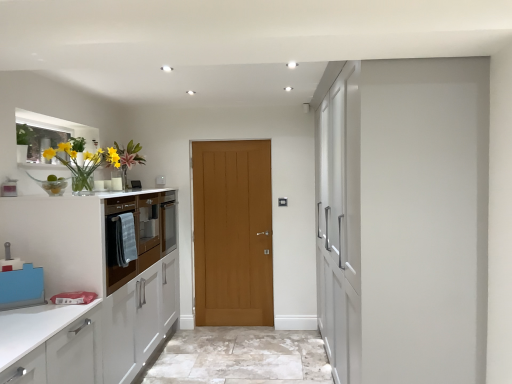
Question: From a real-world perspective, is wooden door at center located higher than matte wood cabinet at left, which is the 1th cabinetry in back-to-front order?

Choices:
 (A) no
 (B) yes

Answer: (A)

Question: Can you confirm if wooden door at center is bigger than matte wood cabinet at left, the second cabinetry in the front-to-back sequence?

Choices:
 (A) yes
 (B) no

Answer: (A)

Question: Is wooden door at center positioned before matte wood cabinet at left, the second cabinetry in the front-to-back sequence?

Choices:
 (A) no
 (B) yes

Answer: (A)

Question: Are wooden door at center and matte wood cabinet at left, which is the 1th cabinetry in back-to-front order, far apart?

Choices:
 (A) no
 (B) yes

Answer: (B)

Question: Does wooden door at center have a lesser width compared to matte wood cabinet at left, the second cabinetry in the front-to-back sequence?

Choices:
 (A) no
 (B) yes

Answer: (B)

Question: Is white glossy cabinetry at left, acting as the 2th cabinetry starting from the back, taller or shorter than wooden door at center?

Choices:
 (A) tall
 (B) short

Answer: (B)

Question: In terms of size, does white glossy cabinetry at left, acting as the 2th cabinetry starting from the back, appear bigger or smaller than wooden door at center?

Choices:
 (A) big
 (B) small

Answer: (A)

Question: Relative to wooden door at center, is white glossy cabinetry at left, acting as the 2th cabinetry starting from the back, in front or behind?

Choices:
 (A) front
 (B) behind

Answer: (A)

Question: Is white glossy cabinetry at left, acting as the 2th cabinetry starting from the back, spatially inside wooden door at center, or outside of it?

Choices:
 (A) inside
 (B) outside

Answer: (B)

Question: Visually, is wooden door at center positioned to the left or to the right of translucent glass vase at left?

Choices:
 (A) left
 (B) right

Answer: (B)

Question: Is point (264, 223) positioned closer to the camera than point (49, 150)?

Choices:
 (A) farther
 (B) closer

Answer: (A)

Question: Is wooden door at center wider or thinner than translucent glass vase at left?

Choices:
 (A) wide
 (B) thin

Answer: (B)

Question: In terms of height, does wooden door at center look taller or shorter compared to translucent glass vase at left?

Choices:
 (A) tall
 (B) short

Answer: (A)

Question: Considering the positions of white glossy cabinetry at left, acting as the 2th cabinetry starting from the back, and matte wood cabinet at left, which is the 1th cabinetry in back-to-front order, in the image, is white glossy cabinetry at left, acting as the 2th cabinetry starting from the back, bigger or smaller than matte wood cabinet at left, which is the 1th cabinetry in back-to-front order,?

Choices:
 (A) small
 (B) big

Answer: (B)

Question: From the image's perspective, relative to matte wood cabinet at left, which is the 1th cabinetry in back-to-front order, is white glossy cabinetry at left, acting as the 2th cabinetry starting from the back, above or below?

Choices:
 (A) above
 (B) below

Answer: (B)